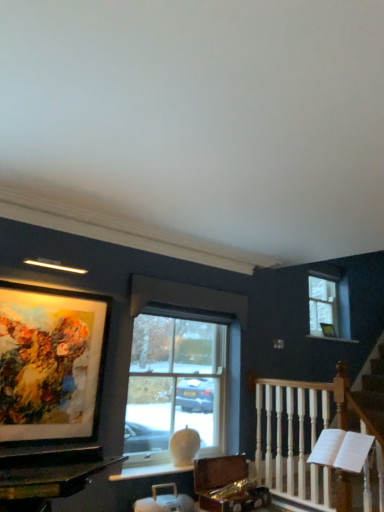
Question: Considering the relative positions of clear glass window at center, acting as the 1th window starting from the front, and matte glass picture frame at upper left in the image provided, is clear glass window at center, acting as the 1th window starting from the front, to the left of matte glass picture frame at upper left from the viewer's perspective?

Choices:
 (A) no
 (B) yes

Answer: (A)

Question: Can you confirm if clear glass window at center, which is counted as the 1th window, starting from the left, is smaller than matte glass picture frame at upper left?

Choices:
 (A) yes
 (B) no

Answer: (B)

Question: Is clear glass window at center, which is the 2th window from right to left, looking in the opposite direction of matte glass picture frame at upper left?

Choices:
 (A) no
 (B) yes

Answer: (A)

Question: Does clear glass window at center, the 2th window viewed from the back, come behind matte glass picture frame at upper left?

Choices:
 (A) no
 (B) yes

Answer: (B)

Question: Considering the relative sizes of clear glass window at center, which is counted as the 1th window, starting from the left, and matte glass picture frame at upper left in the image provided, is clear glass window at center, which is counted as the 1th window, starting from the left, shorter than matte glass picture frame at upper left?

Choices:
 (A) yes
 (B) no

Answer: (B)

Question: Would you consider clear glass window at center, which is the 2th window from right to left, to be distant from matte glass picture frame at upper left?

Choices:
 (A) no
 (B) yes

Answer: (A)

Question: Is white marble window sill at upper center next to clear glass window at upper right, the 2th window viewed from the front, and touching it?

Choices:
 (A) yes
 (B) no

Answer: (B)

Question: Can you confirm if white marble window sill at upper center is taller than clear glass window at upper right, the 2th window viewed from the front?

Choices:
 (A) no
 (B) yes

Answer: (A)

Question: Can you confirm if white marble window sill at upper center is smaller than clear glass window at upper right, the 2th window viewed from the front?

Choices:
 (A) yes
 (B) no

Answer: (A)

Question: From the image's perspective, is white marble window sill at upper center below clear glass window at upper right, the 2th window positioned from the left?

Choices:
 (A) no
 (B) yes

Answer: (B)

Question: From a real-world perspective, is white marble window sill at upper center positioned under clear glass window at upper right, which is the first window from back to front, based on gravity?

Choices:
 (A) yes
 (B) no

Answer: (A)

Question: Could you tell me if white marble window sill at upper center is facing clear glass window at upper right, which is the first window from back to front?

Choices:
 (A) yes
 (B) no

Answer: (B)

Question: Considering the relative positions of matte glass picture frame at upper left and clear glass window at upper right, which is the first window in right-to-left order, in the image provided, is matte glass picture frame at upper left to the left of clear glass window at upper right, which is the first window in right-to-left order, from the viewer's perspective?

Choices:
 (A) no
 (B) yes

Answer: (B)